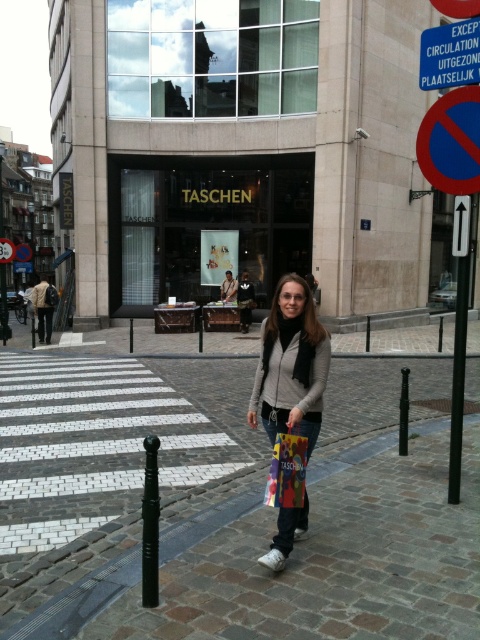
Question: Considering the relative positions of brown cobblestone at center and white plastic arrow at upper right in the image provided, where is brown cobblestone at center located with respect to white plastic arrow at upper right?

Choices:
 (A) left
 (B) right

Answer: (A)

Question: Considering the real-world distances, which object is farthest from the white plastic arrow at upper right?

Choices:
 (A) red plastic circle at upper right
 (B) blue plastic sign at upper center

Answer: (B)

Question: Is brown cobblestone at center to the right of multicolored fabric shopping bag at center from the viewer's perspective?

Choices:
 (A) no
 (B) yes

Answer: (A)

Question: Which point is closer to the camera?

Choices:
 (A) brown cobblestone at center
 (B) blue plastic sign at upper center
 (C) black plastic pole at center

Answer: (A)

Question: Based on their relative distances, which object is farther from the brown cobblestone at center?

Choices:
 (A) black metal pole at center
 (B) multicolored fabric shopping bag at center
 (C) matte gray jacket at center

Answer: (C)

Question: Can you confirm if matte gray jacket at center is thinner than black metal pole at center?

Choices:
 (A) yes
 (B) no

Answer: (B)